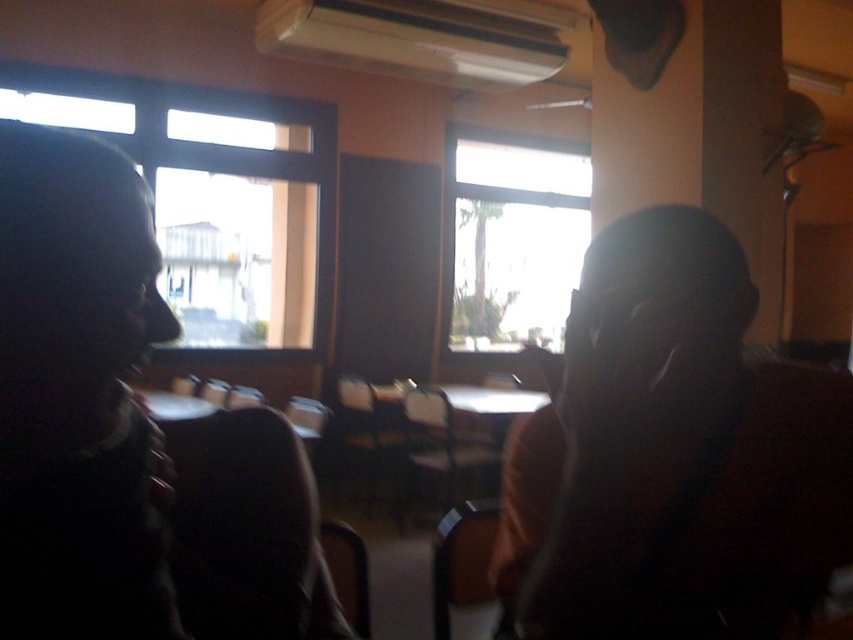
Which is above, dark matte head at center or transparent glass window at left?

transparent glass window at left is above.

Identify the location of dark matte head at center. The image size is (853, 640). (671, 452).

Who is more forward, [809,547] or [80,108]?

Positioned in front is point [809,547].

Locate an element on the screen. dark matte head at center is located at coordinates (671, 452).

Is dark matte head at center thinner than transparent glass window at center?

Indeed, dark matte head at center has a lesser width compared to transparent glass window at center.

Between dark matte head at center and transparent glass window at center, which one has more height?

Standing taller between the two is transparent glass window at center.

Which is in front, point (682, 320) or point (477, 224)?

Positioned in front is point (682, 320).

In order to click on dark matte head at center in this screenshot , I will do `click(671, 452)`.

The width and height of the screenshot is (853, 640). What do you see at coordinates (215, 198) in the screenshot?
I see `transparent glass window at left` at bounding box center [215, 198].

Which is below, transparent glass window at left or transparent glass window at center?

transparent glass window at center

Who is more forward, [16,104] or [485,260]?

Point [16,104] is more forward.

Locate an element on the screen. Image resolution: width=853 pixels, height=640 pixels. transparent glass window at left is located at coordinates 215,198.